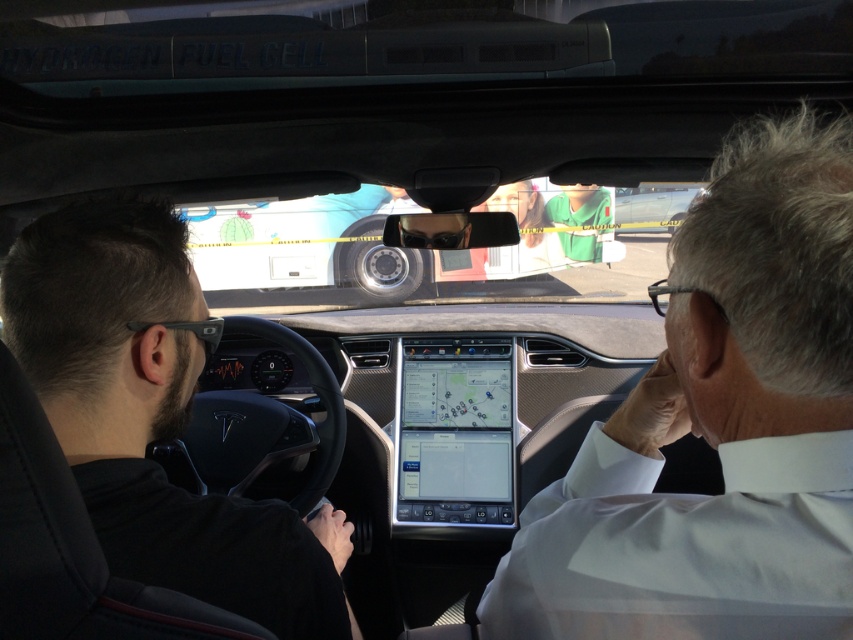
You are sitting in the Tesla and looking out the windshield. You see a person wearing a white shirt at center and another wearing a black matte jacket at left. Which person is closer to the Tesla?

The white shirt at center is closer to the viewer than the black matte jacket at left, so the person in the white shirt at center is closer to the Tesla.

You are a passenger in the Tesla and want to describe the people outside the bus to a friend. Which person has a wider clothing item between the white shirt at center and the black matte jacket at left?

The white shirt at center has a larger width than the black matte jacket at left according to the description.

You are a passenger in the Tesla and notice two people outside the bus through the windshield. The people are wearing the white shirt at center and the black matte jacket at left. Which person is taller?

The white shirt at center is taller than the black matte jacket at left.